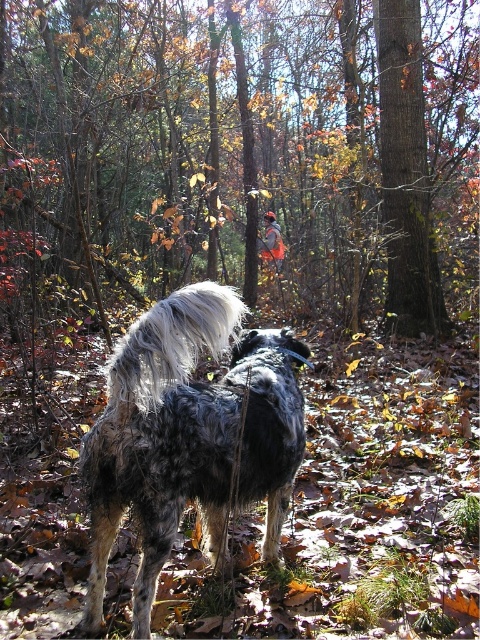
Question: Based on their relative distances, which object is nearer to the smooth bark tree at center?

Choices:
 (A) spotted fur dog at center
 (B) brown rough bark at center

Answer: (B)

Question: Is smooth bark tree at center bigger than brown rough bark at center?

Choices:
 (A) yes
 (B) no

Answer: (A)

Question: Is spotted fur dog at center smaller than brown rough bark at center?

Choices:
 (A) yes
 (B) no

Answer: (A)

Question: Which point is farther to the camera?

Choices:
 (A) (315, 305)
 (B) (384, 92)

Answer: (A)

Question: Is the position of smooth bark tree at center more distant than that of brown rough bark at center?

Choices:
 (A) yes
 (B) no

Answer: (B)

Question: Which is farther from the brown rough bark at center?

Choices:
 (A) smooth bark tree at center
 (B) spotted fur dog at center

Answer: (B)